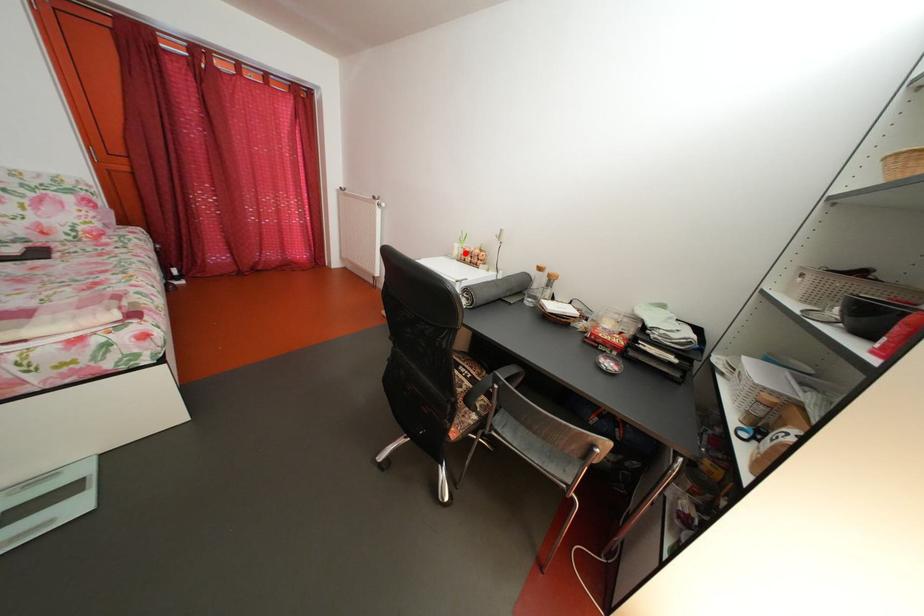
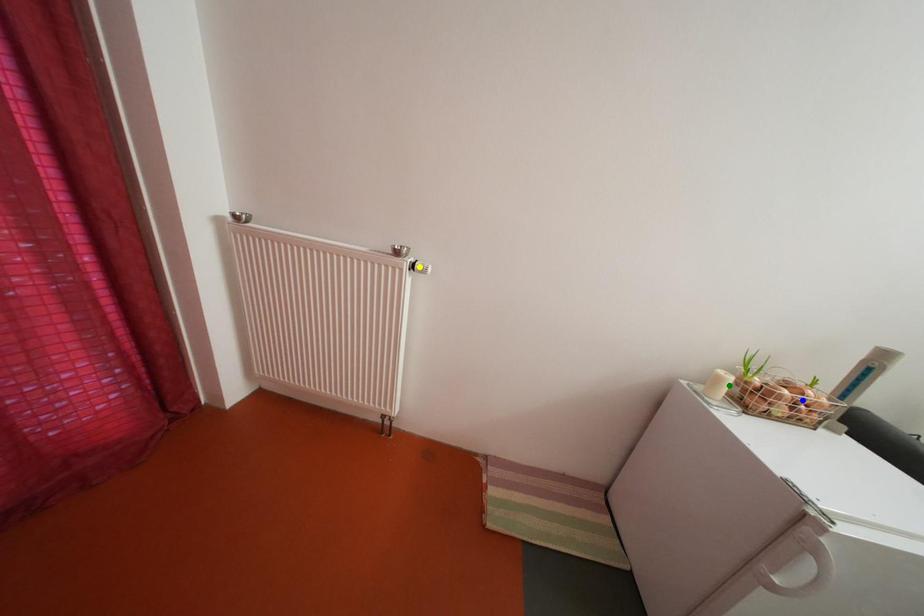
Question: I am providing you with two images of the same scene from different viewpoints. A red point is marked on the first image. You are given multiple points on the second image. Which spot in image 2 lines up with the point in image 1?

Choices:
 (A) yellow point
 (B) blue point
 (C) green point

Answer: (C)